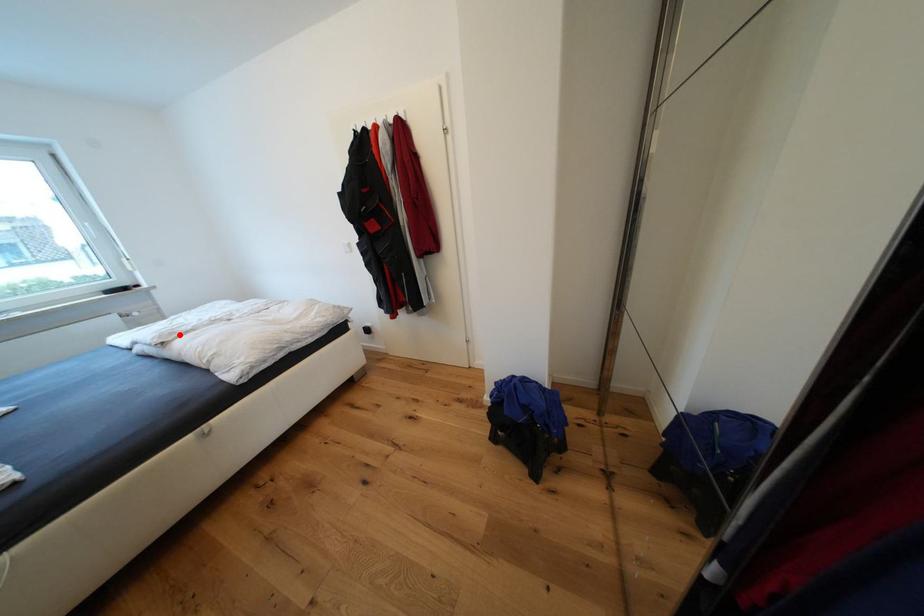
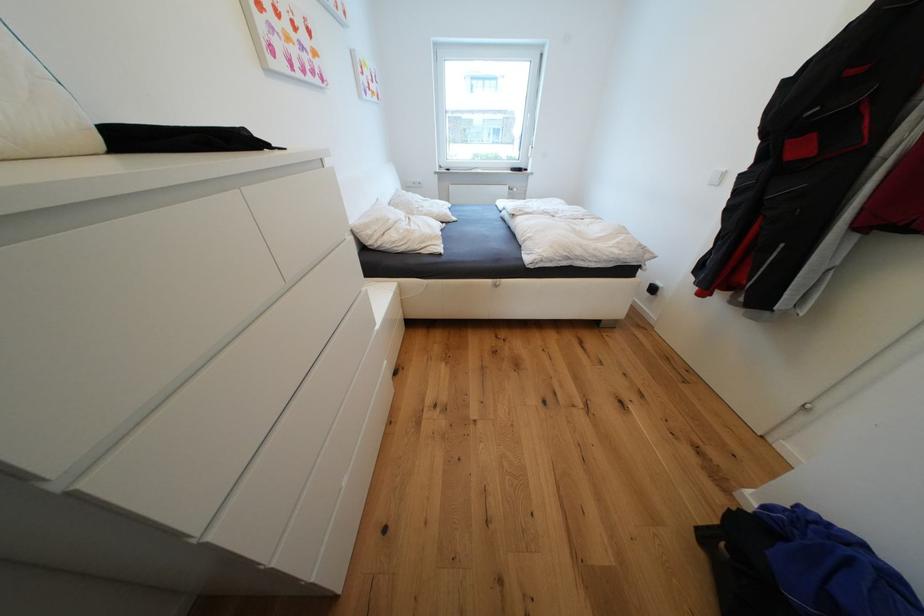
Question: I am providing you with two images of the same scene from different viewpoints. Given a red point in image1, look at the same physical point in image2. Is it:

Choices:
 (A) Closer to the viewpoint
 (B) Farther from the viewpoint

Answer: (A)